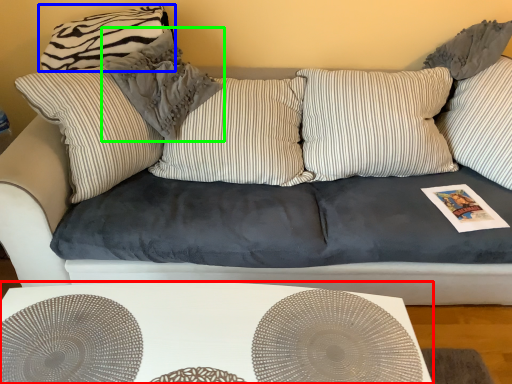
Question: Which object is positioned closest to table (highlighted by a red box)? Select from pillow (highlighted by a blue box) and pillow (highlighted by a green box).

Choices:
 (A) pillow
 (B) pillow

Answer: (B)